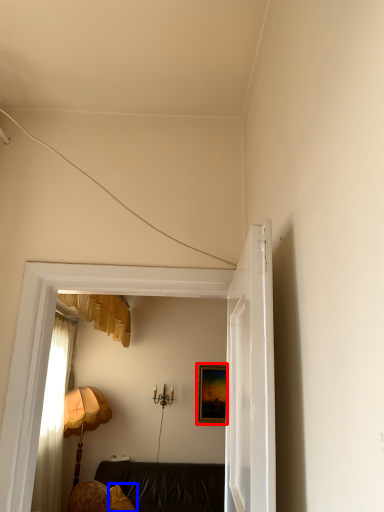
Question: Which object appears farthest to the camera in this image, picture frame (highlighted by a red box) or pillow (highlighted by a blue box)?

Choices:
 (A) picture frame
 (B) pillow

Answer: (A)